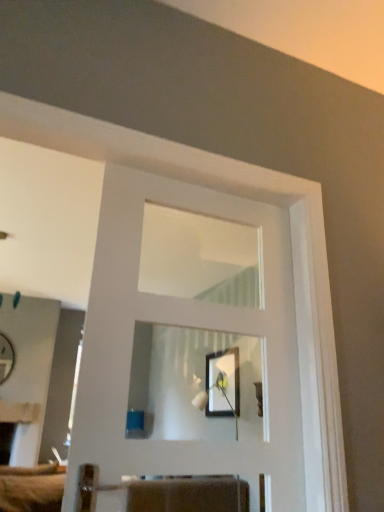
Question: Is matte white mirror at left further to the viewer compared to white glossy door at center?

Choices:
 (A) no
 (B) yes

Answer: (B)

Question: Is matte white mirror at left oriented away from white glossy door at center?

Choices:
 (A) no
 (B) yes

Answer: (A)

Question: Considering the relative sizes of matte white mirror at left and white glossy door at center in the image provided, is matte white mirror at left smaller than white glossy door at center?

Choices:
 (A) no
 (B) yes

Answer: (B)

Question: Does matte white mirror at left appear on the right side of white glossy door at center?

Choices:
 (A) no
 (B) yes

Answer: (A)

Question: Is there a large distance between matte white mirror at left and white glossy door at center?

Choices:
 (A) no
 (B) yes

Answer: (B)

Question: In the image, is matte white mirror at left positioned in front of or behind matte black picture frame at center?

Choices:
 (A) behind
 (B) front

Answer: (A)

Question: Looking at their shapes, would you say matte white mirror at left is wider or thinner than matte black picture frame at center?

Choices:
 (A) thin
 (B) wide

Answer: (B)

Question: Would you say matte white mirror at left is inside or outside matte black picture frame at center?

Choices:
 (A) outside
 (B) inside

Answer: (A)

Question: Is matte white mirror at left taller or shorter than matte black picture frame at center?

Choices:
 (A) tall
 (B) short

Answer: (A)

Question: Do you think matte white mirror at left is within white glossy door at center, or outside of it?

Choices:
 (A) inside
 (B) outside

Answer: (B)

Question: Does point (8, 374) appear closer or farther from the camera than point (122, 422)?

Choices:
 (A) closer
 (B) farther

Answer: (B)

Question: Considering their positions, is matte white mirror at left located in front of or behind white glossy door at center?

Choices:
 (A) behind
 (B) front

Answer: (A)

Question: Looking at the image, does matte white mirror at left seem bigger or smaller compared to white glossy door at center?

Choices:
 (A) small
 (B) big

Answer: (A)

Question: From a real-world perspective, is matte black picture frame at center physically located above or below white glossy door at center?

Choices:
 (A) above
 (B) below

Answer: (A)

Question: Looking at the image, does matte black picture frame at center seem bigger or smaller compared to white glossy door at center?

Choices:
 (A) small
 (B) big

Answer: (A)